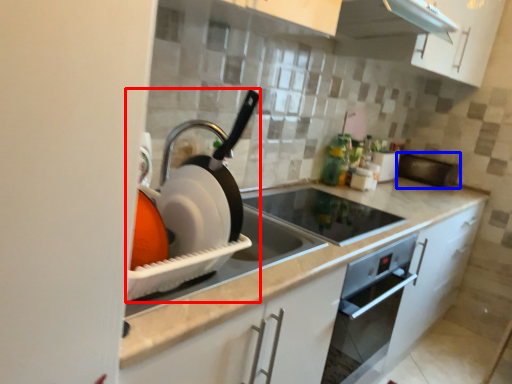
Question: Which point is further to the camera, appliance (highlighted by a red box) or appliance (highlighted by a blue box)?

Choices:
 (A) appliance
 (B) appliance

Answer: (B)